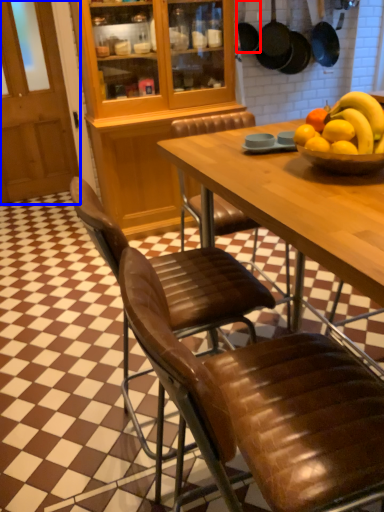
Question: Which point is further to the camera, frying pan (highlighted by a red box) or glass door (highlighted by a blue box)?

Choices:
 (A) frying pan
 (B) glass door

Answer: (A)